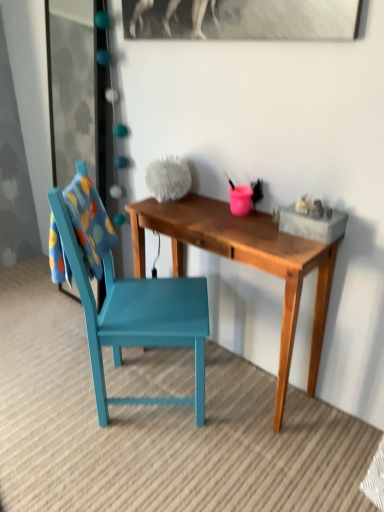
You are a GUI agent. You are given a task and a screenshot of the screen. Output one action in this format:
    pyautogui.click(x=<x>, y=<y>)
    Task: Click on the free space in front of wooden desk at center
    This screenshot has height=512, width=384.
    Given the screenshot: What is the action you would take?
    pyautogui.click(x=224, y=463)